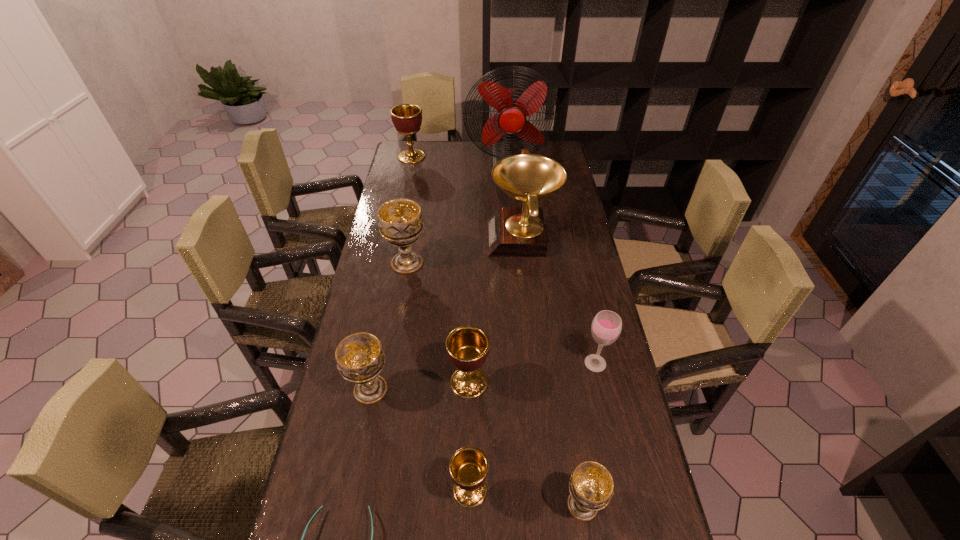
I want to click on vacant point located between the smallest golden chalice and the award, so click(x=496, y=364).

The height and width of the screenshot is (540, 960). I want to click on the third closest object to the fan, so click(x=400, y=221).

I want to click on the third closest object to the second farthest white chalice, so click(320, 508).

Identify which chalice is the nearest to the biggest white chalice. Please provide its 2D coordinates. Your answer should be formatted as a tuple, i.e. [(x, y)], where the tuple contains the x and y coordinates of a point satisfying the conditions above.

[(467, 346)]

Identify which chalice is the sixth nearest to the wineglass. Please provide its 2D coordinates. Your answer should be formatted as a tuple, i.e. [(x, y)], where the tuple contains the x and y coordinates of a point satisfying the conditions above.

[(407, 118)]

You are a GUI agent. You are given a task and a screenshot of the screen. Output one action in this format:
    pyautogui.click(x=<x>, y=<y>)
    Task: Click on the golden chalice that can be found as the second closest to the second farthest chalice
    
    Given the screenshot: What is the action you would take?
    pyautogui.click(x=407, y=118)

Where is `golden chalice that stands as the third closest to the nearest white chalice`? The image size is (960, 540). golden chalice that stands as the third closest to the nearest white chalice is located at coordinates (407, 118).

I want to click on the closest white chalice relative to the farthest chalice, so click(400, 221).

What are the coordinates of `white chalice that can be found as the closest to the shortest object` in the screenshot? It's located at (360, 359).

Image resolution: width=960 pixels, height=540 pixels. What are the coordinates of `free point that satisfies the following two spatial constraints: 1. on the front-facing side of the wineglass; 2. on the right side of the tallest object` in the screenshot? It's located at (525, 363).